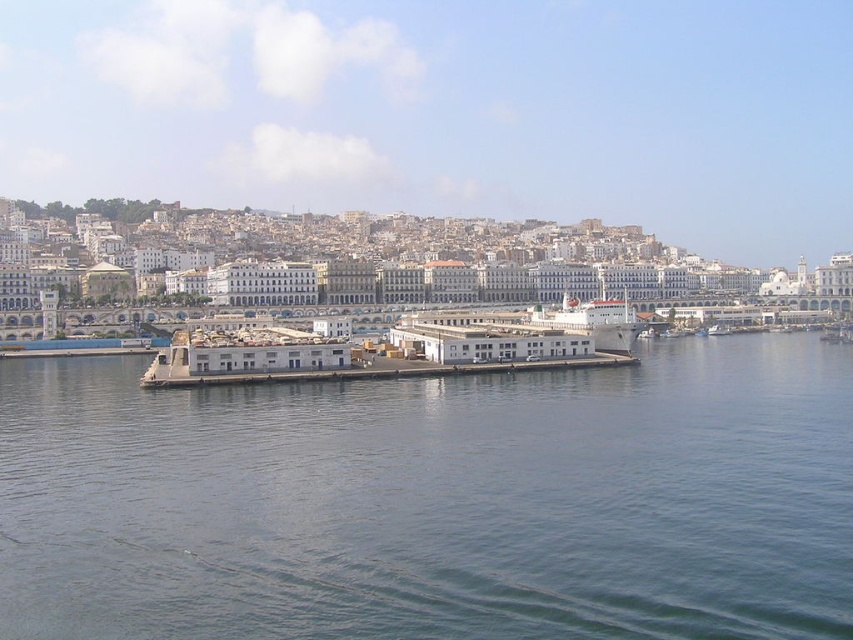
You are standing at the origin point of the waterfront scene. You want to reach the gray concrete dock at center. What are the coordinates you need to move to?

The gray concrete dock at center is located at coordinates point (434, 500). Move to those coordinates to reach it.

Looking at this image, you are standing on the shore and want to walk to the white matte dock at center. There is a gray concrete dock at center in your way. Which dock should you step onto first?

You should step onto the gray concrete dock at center first because it is closer to you than the white matte dock at center.